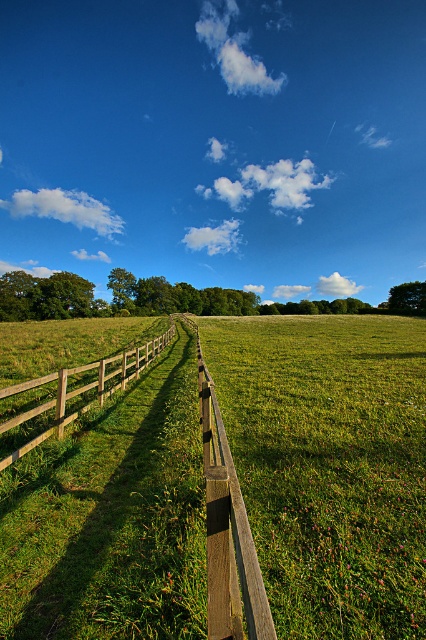
Can you confirm if brown wooden rail at center is positioned below wooden fence at left?

Incorrect, brown wooden rail at center is not positioned below wooden fence at left.

Is brown wooden rail at center smaller than wooden fence at left?

Indeed, brown wooden rail at center has a smaller size compared to wooden fence at left.

Find the location of a particular element. brown wooden rail at center is located at coordinates (227, 531).

Can you confirm if brown wooden fence at center is thinner than wooden fence at left?

In fact, brown wooden fence at center might be wider than wooden fence at left.

Which is behind, point (189, 506) or point (28, 448)?

The point (28, 448) is behind.

What do you see at coordinates (132, 522) in the screenshot?
I see `brown wooden fence at center` at bounding box center [132, 522].

This screenshot has width=426, height=640. I want to click on brown wooden fence at center, so click(132, 522).

Measure the distance between brown wooden fence at center and brown wooden rail at center.

brown wooden fence at center and brown wooden rail at center are 5.10 feet apart from each other.

Image resolution: width=426 pixels, height=640 pixels. Describe the element at coordinates (132, 522) in the screenshot. I see `brown wooden fence at center` at that location.

Does point (88, 484) lie in front of point (213, 468)?

No, it is not.

Identify the location of brown wooden fence at center. The height and width of the screenshot is (640, 426). (132, 522).